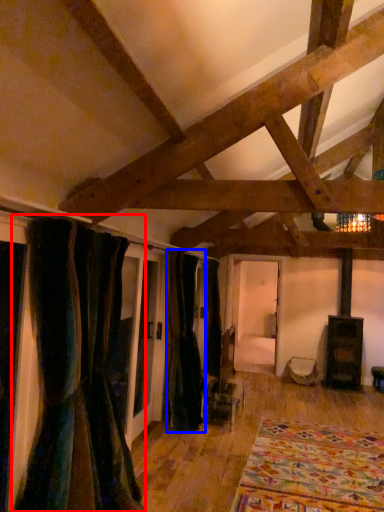
Question: Which object is further to the camera taking this photo, curtain (highlighted by a red box) or curtain (highlighted by a blue box)?

Choices:
 (A) curtain
 (B) curtain

Answer: (B)